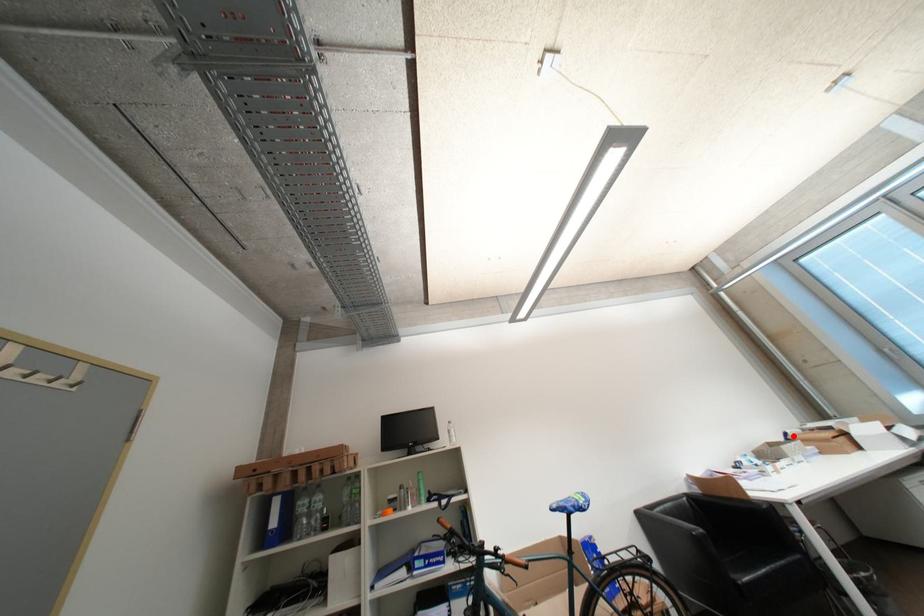
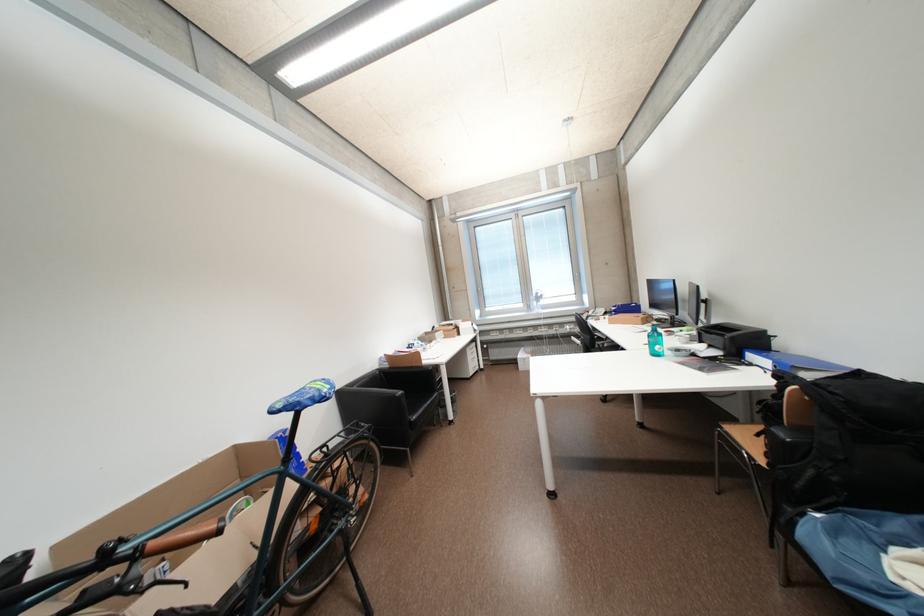
In the second image, find the point that corresponds to the highlighted location in the first image.

(442, 330)